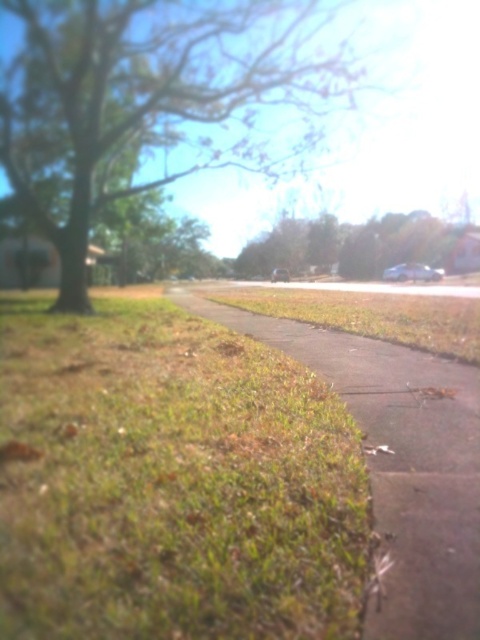
You are a gardener planning to mow the lawn. You see the green grass at lower left and the green grassy pavement at lower center. Which area should you mow first if you want to start from the closest point to the sidewalk?

Answer: The green grass at lower left should be mowed first because it is positioned under the green grassy pavement at lower center, meaning it is closer to the sidewalk.

You are a gardener standing on the sidewalk and want to water both the green grass at lower left and the green leafy tree at center. Which object should you water first if you want to avoid walking through the other one?

You should water the green grass at lower left first because it is in front of the green leafy tree at center, so you can reach it without needing to walk through the tree. After watering the grass, you can move around to water the tree without obstruction.